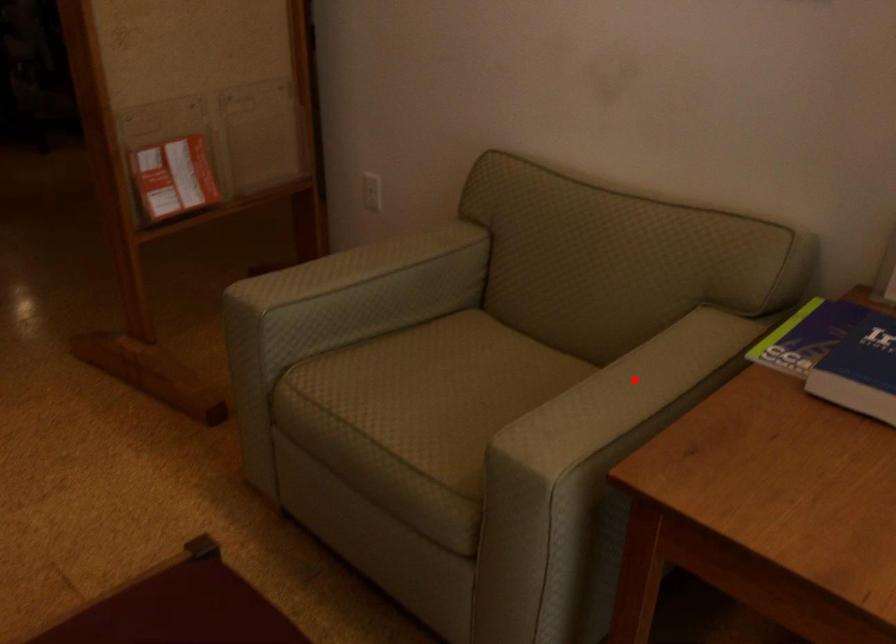
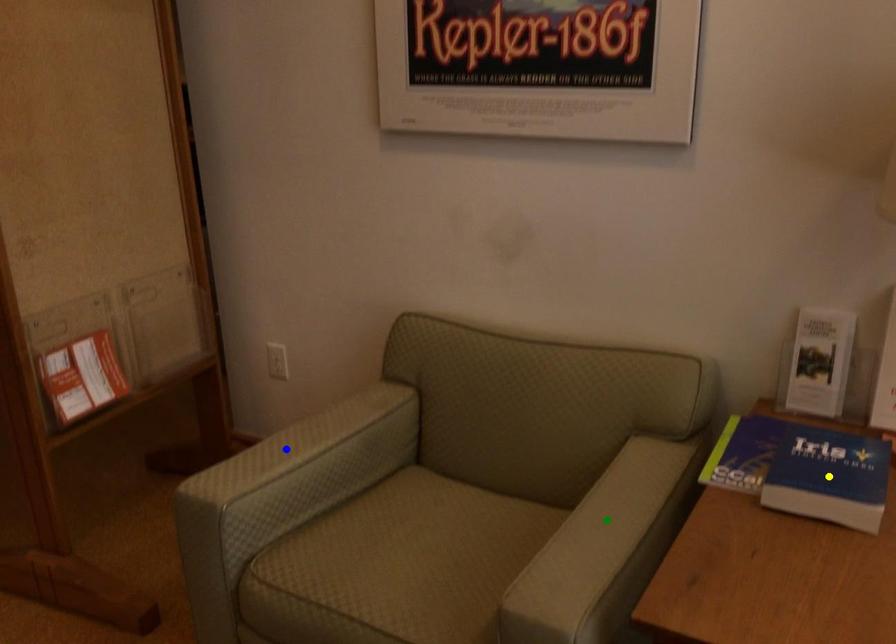
Question: I am providing you with two images of the same scene from different viewpoints. A red point is marked on the first image. You are given multiple points on the second image. Which spot in image 2 lines up with the point in image 1?

Choices:
 (A) green point
 (B) blue point
 (C) yellow point

Answer: (A)